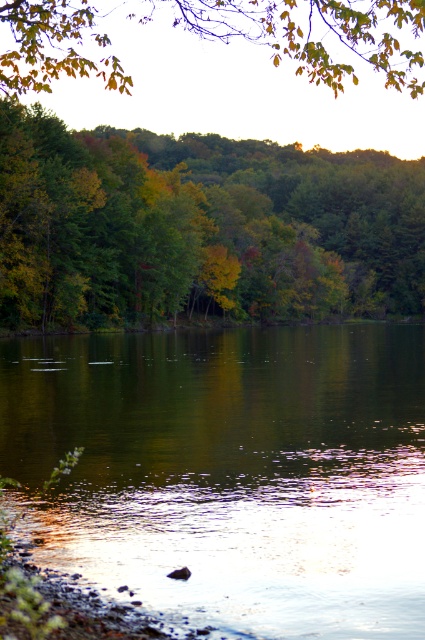
Which is behind, point (413, 552) or point (79, 10)?

Positioned behind is point (79, 10).

Can you confirm if green reflective water at center is wider than green matte leaves at upper center?

No.

Find the location of a particular element. This screenshot has height=640, width=425. green reflective water at center is located at coordinates (x=232, y=472).

Is green leafy tree at upper left taller than green matte leaves at upper center?

In fact, green leafy tree at upper left may be shorter than green matte leaves at upper center.

Measure the distance from green leafy tree at upper left to green matte leaves at upper center.

They are 89.45 feet apart.

This screenshot has height=640, width=425. What are the coordinates of `green leafy tree at upper left` in the screenshot? It's located at point(200,227).

Is green reflective water at center positioned before green leafy tree at upper left?

Yes, green reflective water at center is in front of green leafy tree at upper left.

Can you confirm if green reflective water at center is shorter than green leafy tree at upper left?

Indeed, green reflective water at center has a lesser height compared to green leafy tree at upper left.

Who is more forward, (410, 360) or (268, 204)?

Positioned in front is point (410, 360).

In order to click on green reflective water at center in this screenshot , I will do `click(232, 472)`.